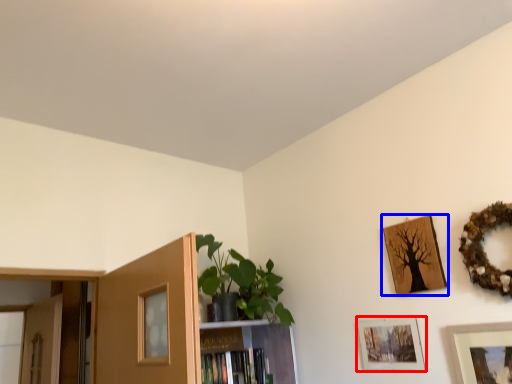
Question: Which object appears closest to the camera in this image, picture frame (highlighted by a red box) or picture frame (highlighted by a blue box)?

Choices:
 (A) picture frame
 (B) picture frame

Answer: (B)